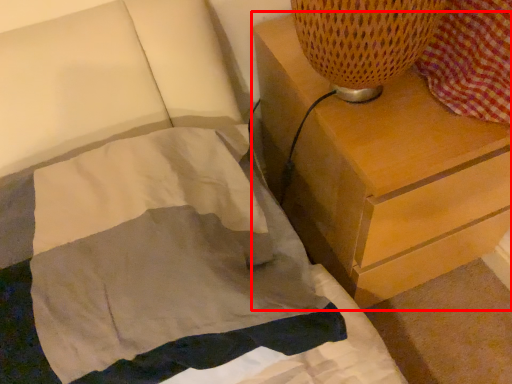
Question: From the image's perspective, what is the correct spatial relationship of chest of drawers (annotated by the red box) in relation to blanket?

Choices:
 (A) above
 (B) below

Answer: (A)